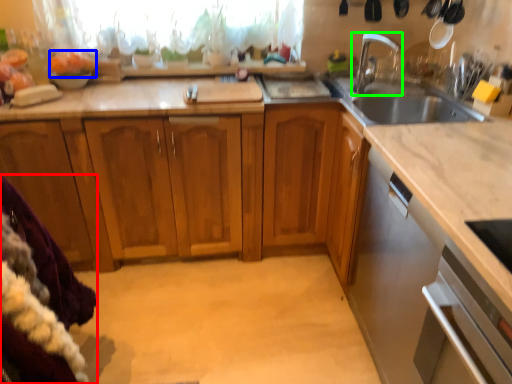
Question: Estimate the real-world distances between objects in this image. Which object is farther from blanket (highlighted by a red box), food (highlighted by a blue box) or tap (highlighted by a green box)?

Choices:
 (A) food
 (B) tap

Answer: (B)